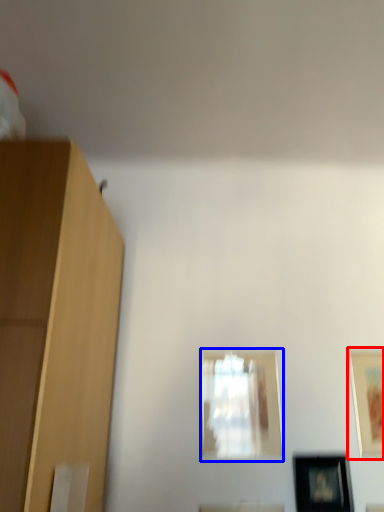
Question: Which object is further to the camera taking this photo, picture frame (highlighted by a red box) or picture frame (highlighted by a blue box)?

Choices:
 (A) picture frame
 (B) picture frame

Answer: (B)